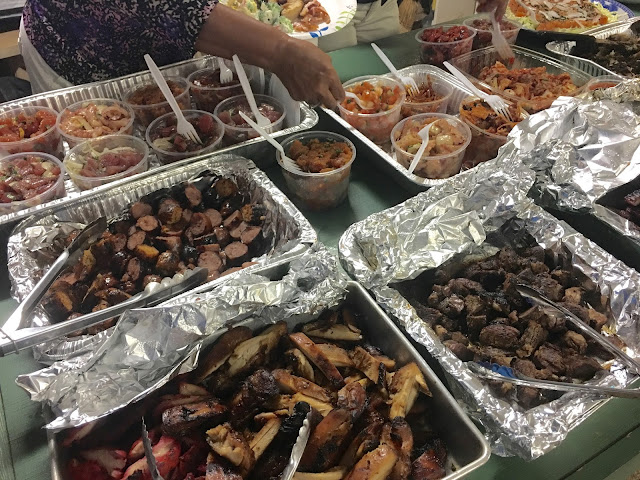
Where is `green table`? green table is located at coordinates tap(374, 199).